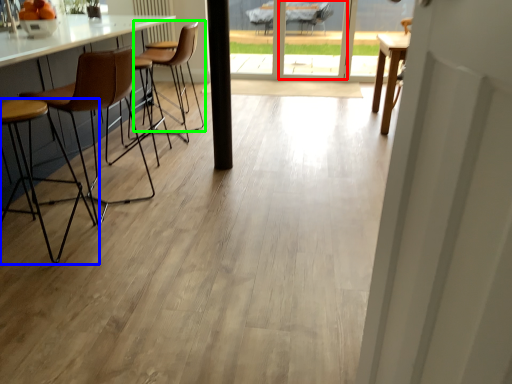
Question: Based on their relative distances, which object is farther from screen door (highlighted by a red box)? Choose from chair (highlighted by a blue box) and chair (highlighted by a green box).

Choices:
 (A) chair
 (B) chair

Answer: (A)